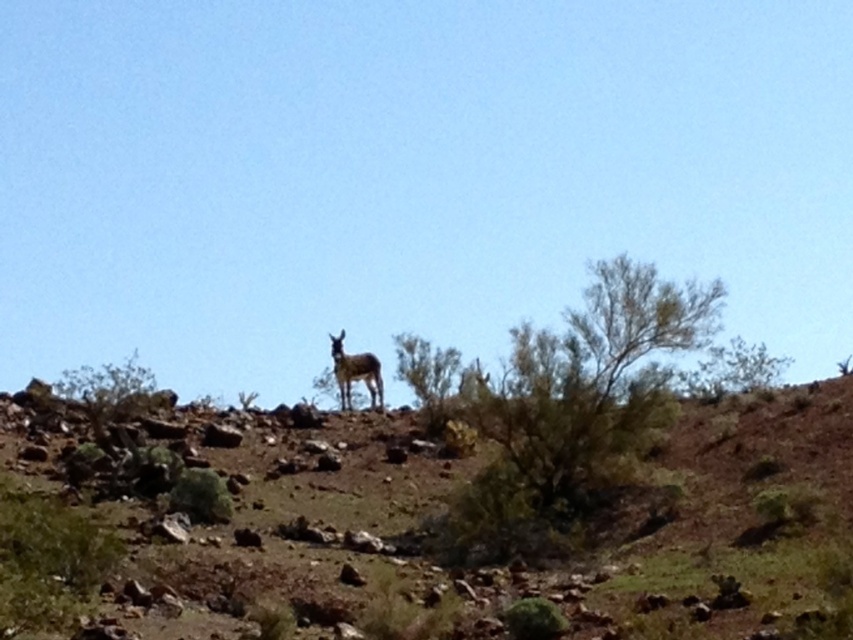
Does brown rocky hillside at center appear under brown furry deer at center?

Correct, brown rocky hillside at center is located below brown furry deer at center.

Does brown rocky hillside at center have a greater height compared to brown furry deer at center?

Yes, brown rocky hillside at center is taller than brown furry deer at center.

The width and height of the screenshot is (853, 640). Identify the location of brown rocky hillside at center. (509, 540).

At what (x,y) coordinates should I click in order to perform the action: click on brown rocky hillside at center. Please return your answer as a coordinate pair (x, y). This screenshot has height=640, width=853. Looking at the image, I should click on pyautogui.click(x=509, y=540).